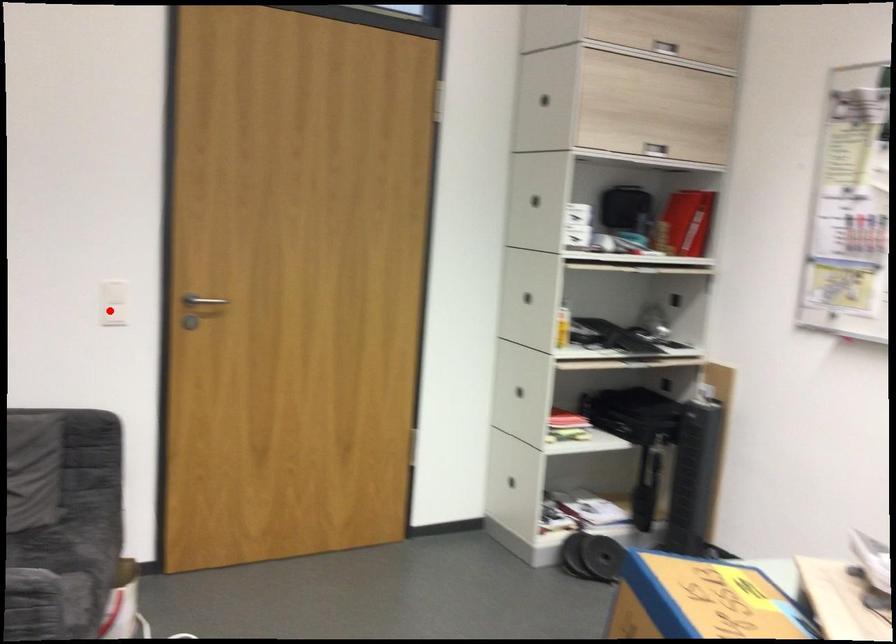
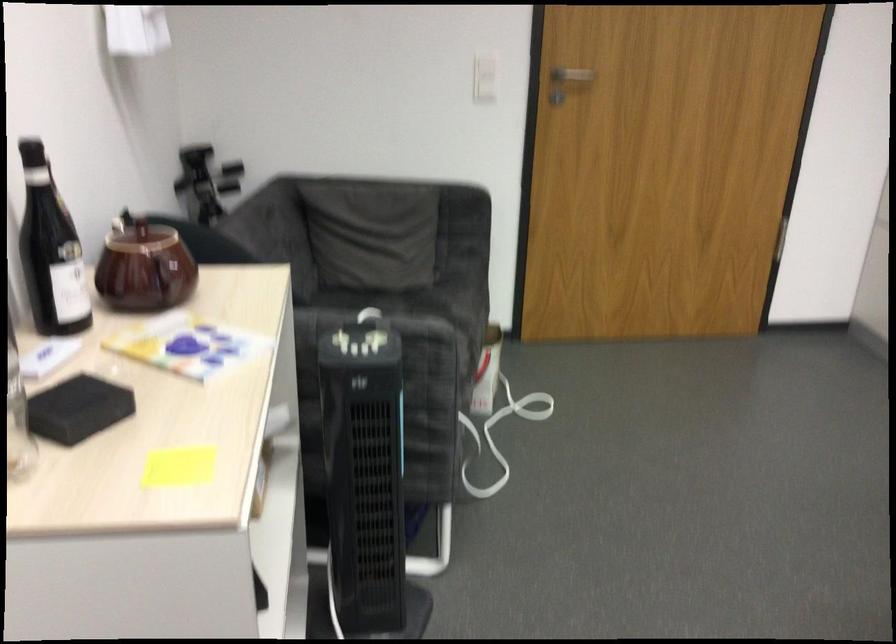
Find the pixel in the second image that matches the highlighted location in the first image.

(484, 77)